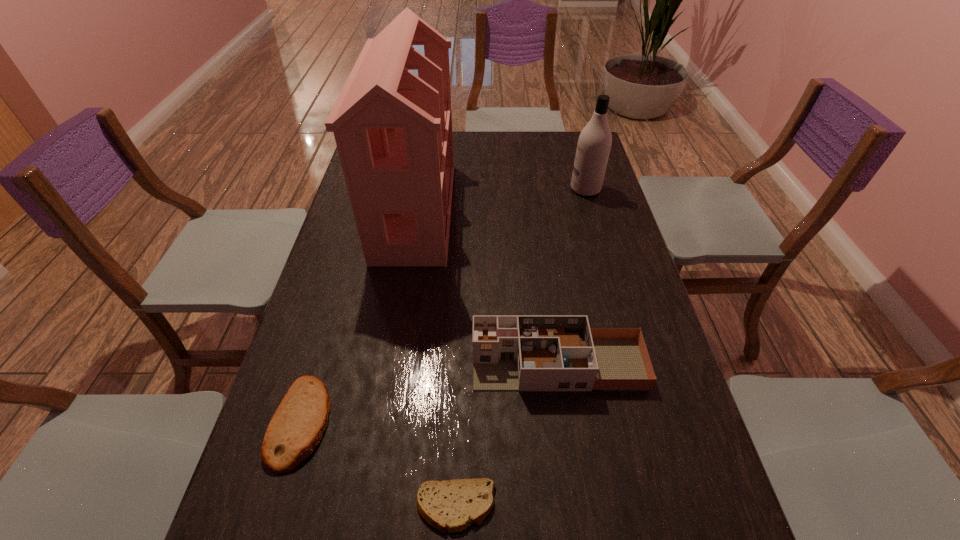
I want to click on the tallest object, so point(393,130).

You are a GUI agent. You are given a task and a screenshot of the screen. Output one action in this format:
    pyautogui.click(x=<x>, y=<y>)
    Task: Click on the farther dollhouse
    The width and height of the screenshot is (960, 540).
    Given the screenshot: What is the action you would take?
    pyautogui.click(x=393, y=130)

You are a GUI agent. You are given a task and a screenshot of the screen. Output one action in this format:
    pyautogui.click(x=<x>, y=<y>)
    Task: Click on the second tallest object
    
    Given the screenshot: What is the action you would take?
    pyautogui.click(x=594, y=143)

You are a GUI agent. You are given a task and a screenshot of the screen. Output one action in this format:
    pyautogui.click(x=<x>, y=<y>)
    Task: Click on the nearer dollhouse
    
    Given the screenshot: What is the action you would take?
    pyautogui.click(x=510, y=352)

Identify the location of the right dollhouse. The width and height of the screenshot is (960, 540). (510, 352).

Where is `the farther pita bread`? the farther pita bread is located at coordinates tap(295, 430).

Identify the location of the taller pita bread. This screenshot has height=540, width=960. (295, 430).

Where is `the right pita bread`? This screenshot has width=960, height=540. the right pita bread is located at coordinates click(449, 505).

The image size is (960, 540). I want to click on the shorter pita bread, so click(449, 505).

Where is `free space located 0.170m on the front-facing side of the tallest object`? This screenshot has width=960, height=540. free space located 0.170m on the front-facing side of the tallest object is located at coordinates (505, 211).